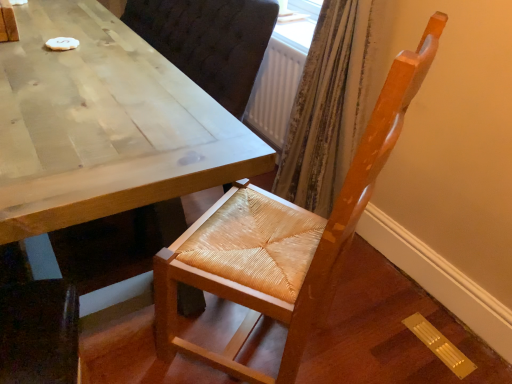
The width and height of the screenshot is (512, 384). I want to click on light brown wooden table at center, so click(104, 125).

Describe the element at coordinates (104, 125) in the screenshot. I see `light brown wooden table at center` at that location.

What is the approximate height of light brown wooden table at center?

29.15 inches.

The width and height of the screenshot is (512, 384). What do you see at coordinates (282, 240) in the screenshot?
I see `woven wood chair at center` at bounding box center [282, 240].

At what (x,y) coordinates should I click in order to perform the action: click on woven wood chair at center. Please return your answer as a coordinate pair (x, y). The height and width of the screenshot is (384, 512). Looking at the image, I should click on (282, 240).

Find the location of `light brown wooden table at center`. light brown wooden table at center is located at coordinates (104, 125).

Is woven wood chair at center to the left of light brown wooden table at center from the viewer's perspective?

No, woven wood chair at center is not to the left of light brown wooden table at center.

Is woven wood chair at center in front of or behind light brown wooden table at center in the image?

In the image, woven wood chair at center appears in front of light brown wooden table at center.

Is point (352, 169) positioned in front of point (42, 313)?

Yes, point (352, 169) is closer to viewer.

From the image's perspective, which one is positioned higher, woven wood chair at center or light brown wooden table at center?

light brown wooden table at center is shown above in the image.

From a real-world perspective, is woven wood chair at center physically located above or below light brown wooden table at center?

woven wood chair at center is situated higher than light brown wooden table at center in the real world.

Between woven wood chair at center and light brown wooden table at center, which one has larger width?

light brown wooden table at center.

Is woven wood chair at center shorter than light brown wooden table at center?

Incorrect, the height of woven wood chair at center does not fall short of that of light brown wooden table at center.

Can you confirm if woven wood chair at center is smaller than light brown wooden table at center?

Indeed, woven wood chair at center has a smaller size compared to light brown wooden table at center.

Could light brown wooden table at center be considered to be inside woven wood chair at center?

No, light brown wooden table at center is not surrounded by woven wood chair at center.

Is woven wood chair at center touching light brown wooden table at center?

No, woven wood chair at center is not next to light brown wooden table at center.

Is woven wood chair at center facing towards light brown wooden table at center?

Yes, woven wood chair at center is facing light brown wooden table at center.

Can you tell me how much woven wood chair at center and light brown wooden table at center differ in facing direction?

54.8 degrees.

How far apart are woven wood chair at center and light brown wooden table at center?

woven wood chair at center and light brown wooden table at center are 16.99 inches apart from each other.

Image resolution: width=512 pixels, height=384 pixels. Find the location of `table that is on the left side of woven wood chair at center`. table that is on the left side of woven wood chair at center is located at coordinates (104, 125).

Based on the photo, considering the relative positions of light brown wooden table at center and woven wood chair at center in the image provided, is light brown wooden table at center to the left of woven wood chair at center from the viewer's perspective?

Yes, light brown wooden table at center is to the left of woven wood chair at center.

In the image, is light brown wooden table at center positioned in front of or behind woven wood chair at center?

light brown wooden table at center is behind woven wood chair at center.

Does point (203, 127) come farther from viewer compared to point (393, 63)?

No, (203, 127) is closer to viewer.

From the image's perspective, is light brown wooden table at center above or below woven wood chair at center?

From the image's perspective, light brown wooden table at center appears above woven wood chair at center.

From a real-world perspective, between light brown wooden table at center and woven wood chair at center, who is vertically lower?

light brown wooden table at center is physically lower.

Considering the relative sizes of light brown wooden table at center and woven wood chair at center in the image provided, is light brown wooden table at center thinner than woven wood chair at center?

Incorrect, the width of light brown wooden table at center is not less than that of woven wood chair at center.

Does light brown wooden table at center have a lesser height compared to woven wood chair at center?

Yes, light brown wooden table at center is shorter than woven wood chair at center.

Who is bigger, light brown wooden table at center or woven wood chair at center?

With larger size is light brown wooden table at center.

In the scene shown: Is woven wood chair at center inside light brown wooden table at center?

Definitely not — woven wood chair at center is not inside light brown wooden table at center.

Are light brown wooden table at center and woven wood chair at center making contact?

They are not placed beside each other.

Is light brown wooden table at center oriented towards woven wood chair at center?

No.

Can you tell me how much light brown wooden table at center and woven wood chair at center differ in facing direction?

They differ by 54.8 degrees in their facing directions.

How much distance is there between light brown wooden table at center and woven wood chair at center?

The distance of light brown wooden table at center from woven wood chair at center is 16.99 inches.

In order to click on chair that appears in front of the light brown wooden table at center in this screenshot , I will do `click(282, 240)`.

Where is `chair on the right of the light brown wooden table at center`? The image size is (512, 384). chair on the right of the light brown wooden table at center is located at coordinates (282, 240).

This screenshot has width=512, height=384. Find the location of `table directly beneath the woven wood chair at center (from a real-world perspective)`. table directly beneath the woven wood chair at center (from a real-world perspective) is located at coordinates (104, 125).